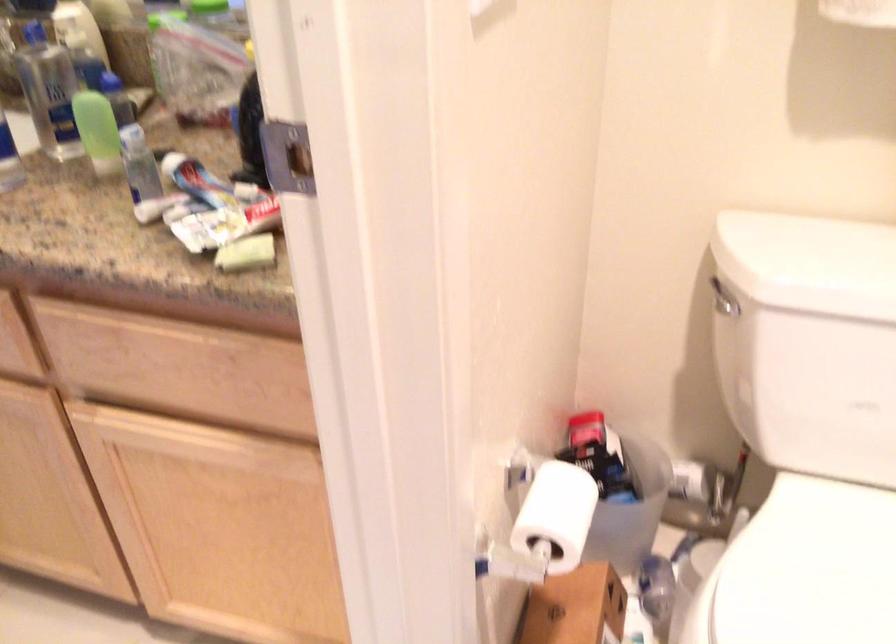
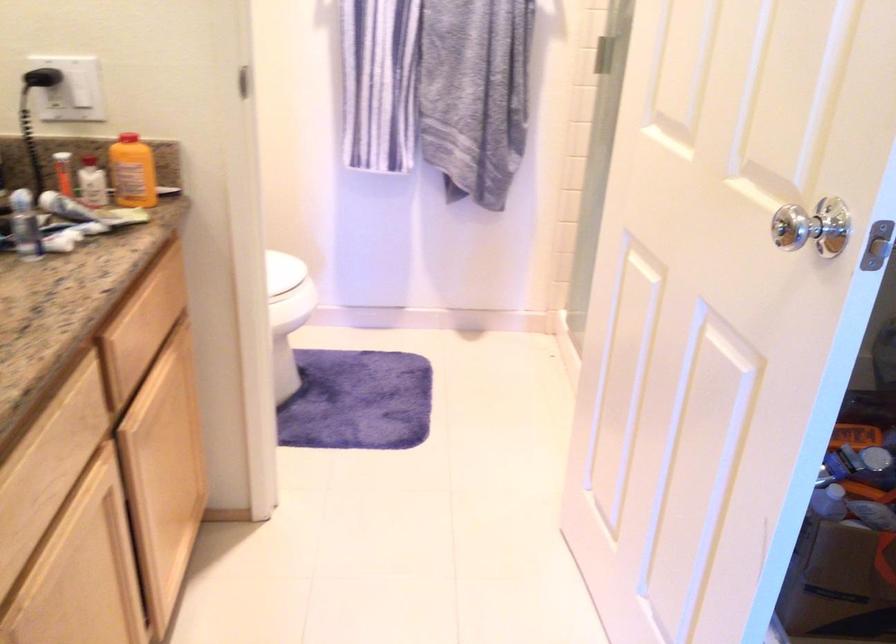
The point at (300, 200) is marked in the first image. Where is the corresponding point in the second image?

(133, 172)